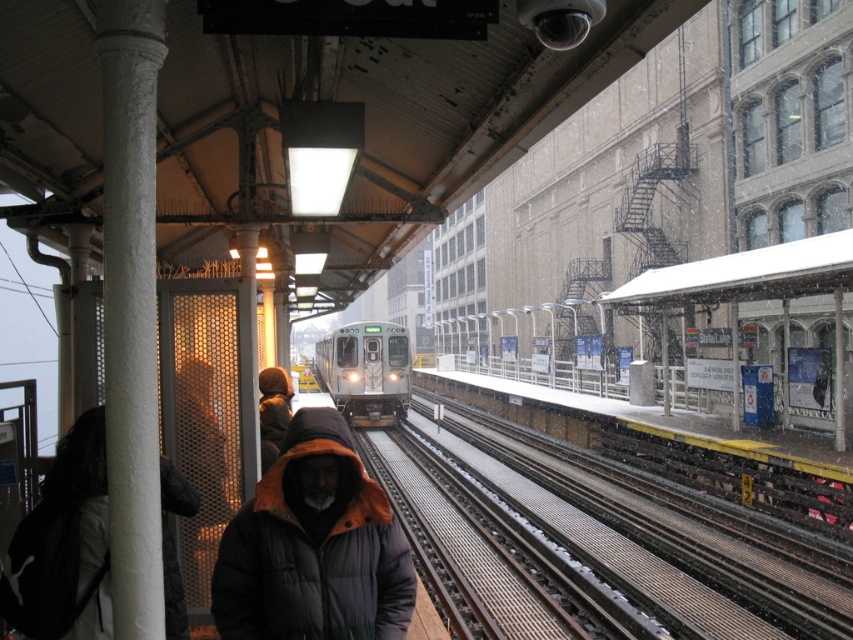
You are a photographer trying to capture both the dark gray hooded jacket at left and the brown leather jacket at center in the same frame. Based on their positions, which jacket will appear larger in the photo?

The dark gray hooded jacket at left appears larger in the photo because it has a greater height compared to the brown leather jacket at center.